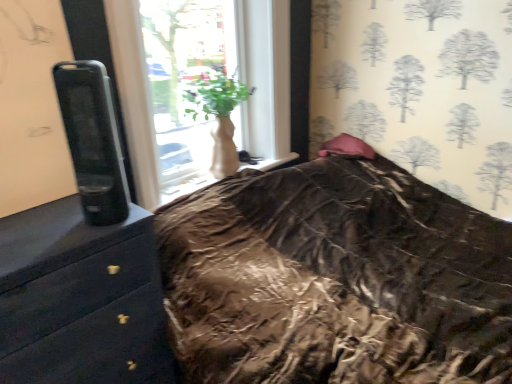
Question: Is white matte vase at center inside or outside of pink satin pillow at upper right?

Choices:
 (A) outside
 (B) inside

Answer: (A)

Question: Considering the positions of point (187, 112) and point (360, 140), is point (187, 112) closer or farther from the camera than point (360, 140)?

Choices:
 (A) closer
 (B) farther

Answer: (A)

Question: Considering the real-world distances, which object is farthest from the black glossy chest of drawers at left?

Choices:
 (A) white matte vase at center
 (B) pink satin pillow at upper right

Answer: (B)

Question: Estimate the real-world distances between objects in this image. Which object is closer to the pink satin pillow at upper right?

Choices:
 (A) black glossy chest of drawers at left
 (B) white matte vase at center

Answer: (B)